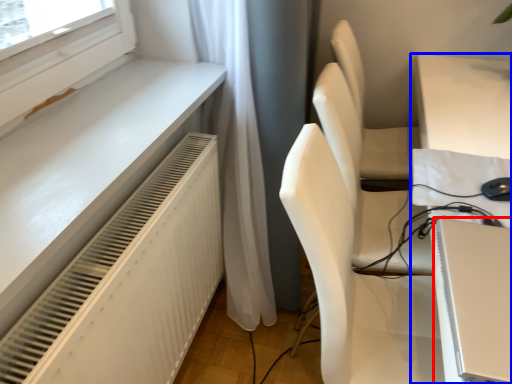
Question: Which object appears closest to the camera in this image, computer (highlighted by a red box) or table (highlighted by a blue box)?

Choices:
 (A) computer
 (B) table

Answer: (B)